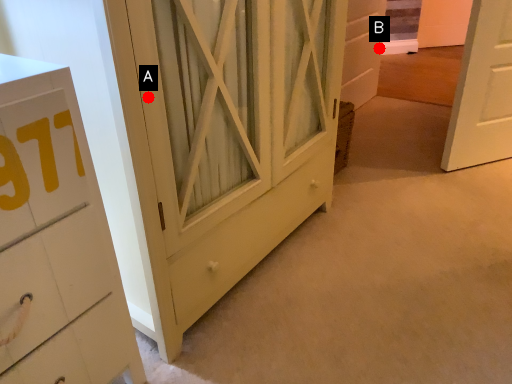
Question: Two points are circled on the image, labeled by A and B beside each circle. Which point is further to the camera?

Choices:
 (A) A is further
 (B) B is further

Answer: (B)